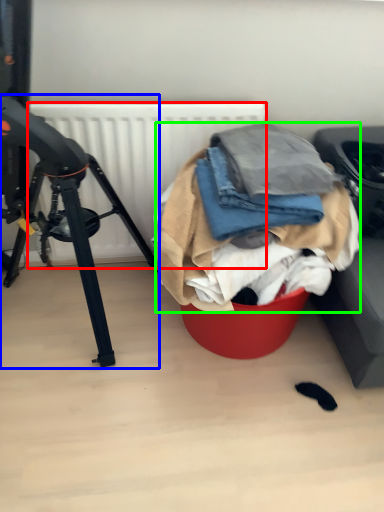
Question: Considering the real-world distances, which object is farthest from radiator (highlighted by a red box)? tripod (highlighted by a blue box) or clothing (highlighted by a green box)?

Choices:
 (A) tripod
 (B) clothing

Answer: (B)